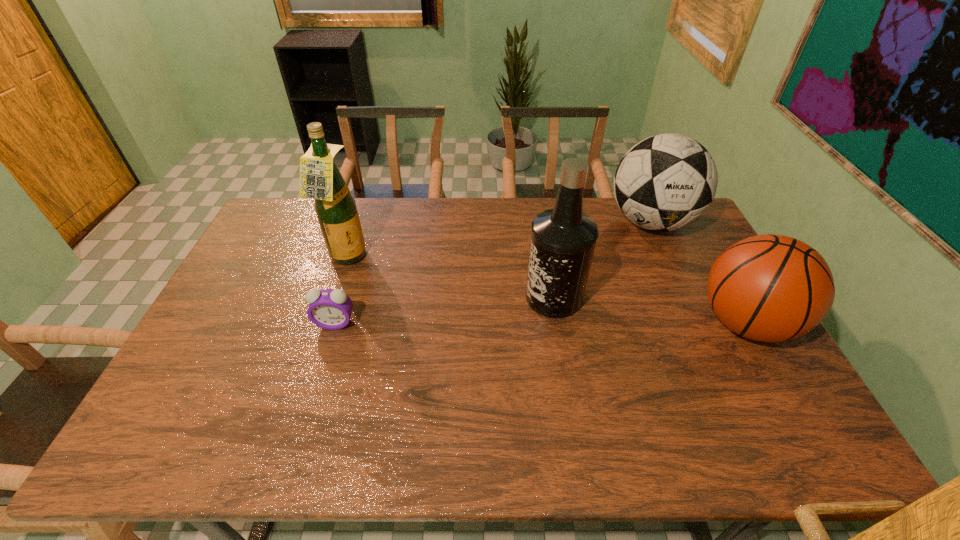
Locate an element on the screen. The width and height of the screenshot is (960, 540). vacant space on the desktop that is between the alarm clock and the basketball and is positioned on the front label of the right liquor is located at coordinates (497, 323).

Find the location of a particular element. The width and height of the screenshot is (960, 540). free space on the desktop that is between the shortest object and the basketball and is positioned on the front-facing side of the left liquor is located at coordinates (489, 323).

I want to click on free space on the desktop that is between the alarm clock and the basketball and is positioned on the surface of the soccer ball where the brand logo is visible, so click(x=556, y=323).